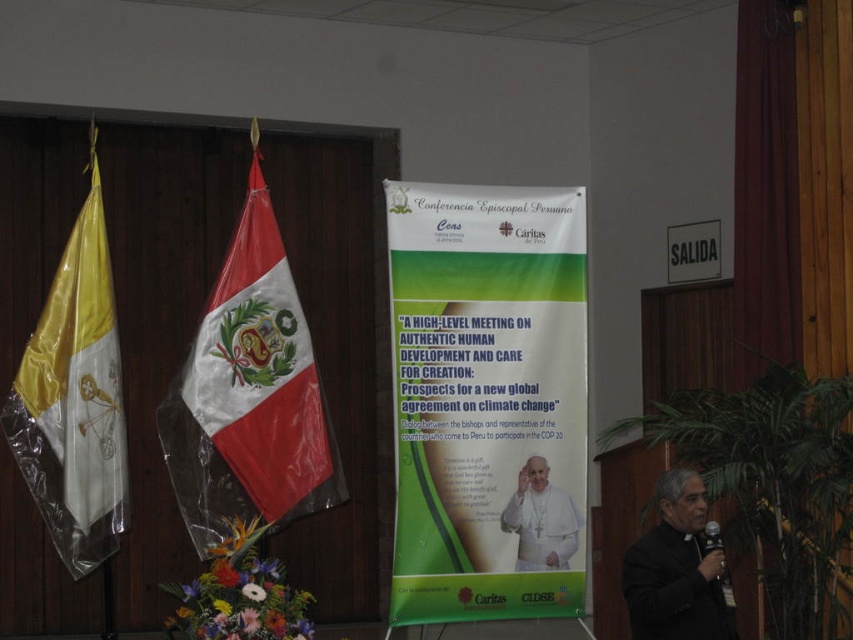
You are a photographer positioned at the camera location. You need to capture a clear photo of the yellow satin flag at left. Considering its distance from the camera, can you estimate if it will be in focus without adjusting your camera settings?

The yellow satin flag at left is 16.85 feet from the camera. Since standard camera focus ranges typically accommodate distances beyond 16 feet, it should be in focus without adjustments.

You are an event organizer who needs to ensure the green matte poster at center and the black matte priest at lower right are positioned correctly for a photo shoot. Based on their sizes, which object should be placed closer to the camera to maintain visual balance?

The green matte poster at center is wider than the black matte priest at lower right. To maintain visual balance, the black matte priest at lower right should be placed closer to the camera since it is narrower and needs to appear proportionally larger in the photo.

In the scene shown: You are a photographer setting up for an event in the conference room. You need to position a camera to capture both the yellow satin flag at left and the white cloth at center without moving the camera. Which object should you ensure is in focus first to avoid blurring?

The yellow satin flag at left is above the white cloth at center, so you should focus on the yellow satin flag at left first since it is closer to the camera.